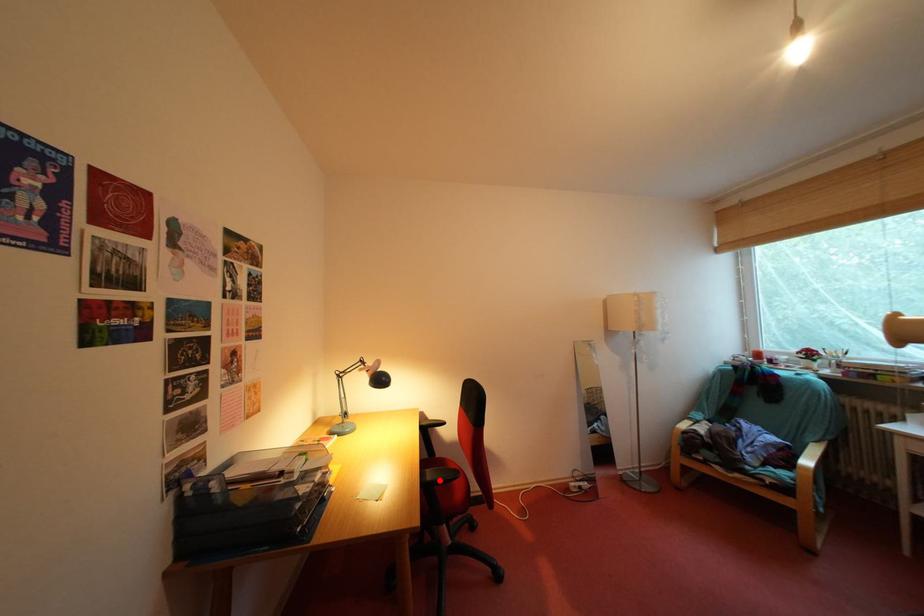
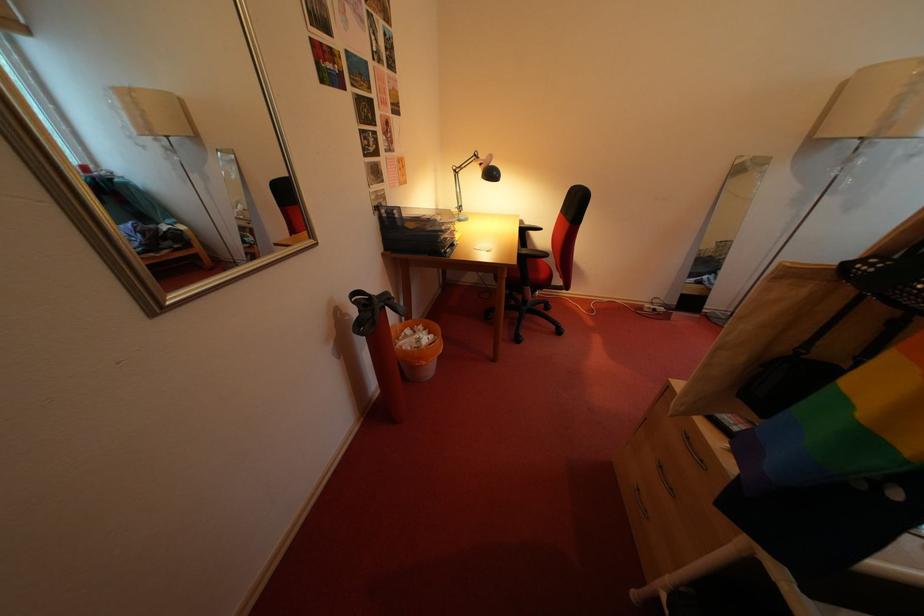
Where in the second image is the point corresponding to the highlighted location from the first image?

(535, 257)